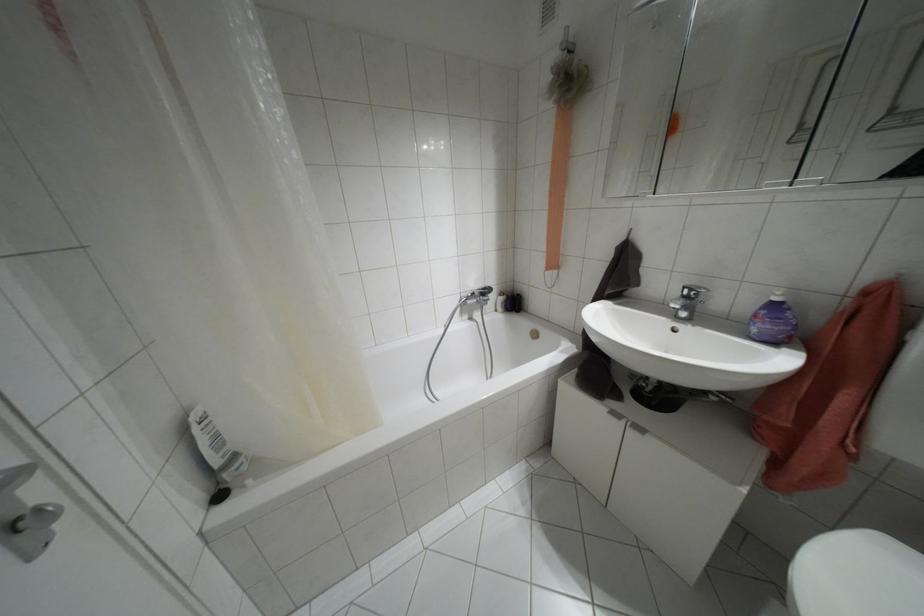
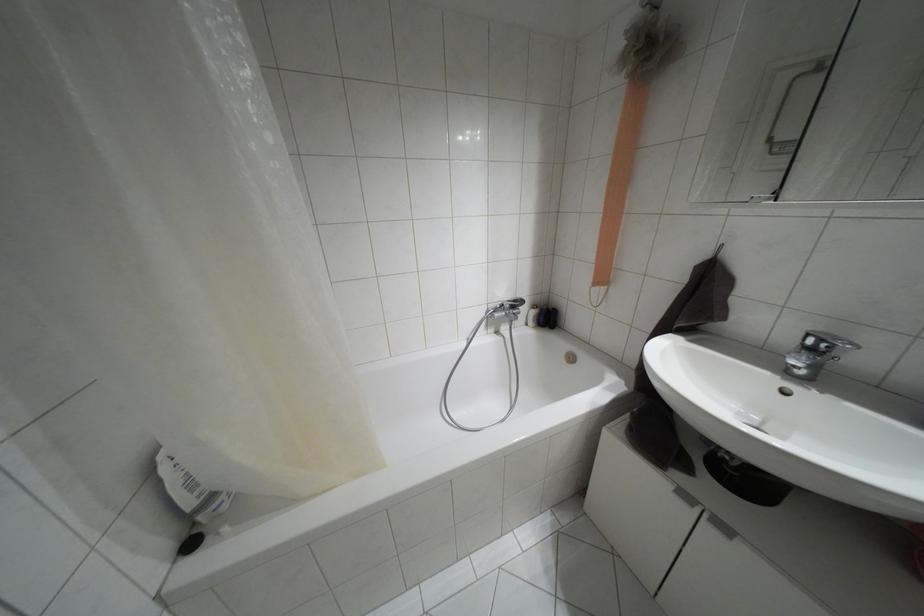
Where in the second image is the point corresponding to point 513,302 from the first image?

(546, 317)